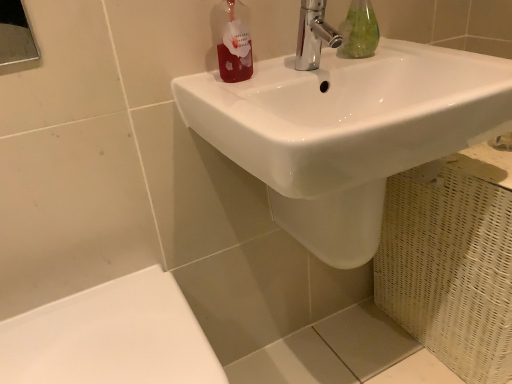
Question: Is point pos(234,16) positioned closer to the camera than point pos(184,332)?

Choices:
 (A) farther
 (B) closer

Answer: (A)

Question: From the image's perspective, relative to white glossy porcelain at lower left, is translucent red bottle at upper center above or below?

Choices:
 (A) above
 (B) below

Answer: (A)

Question: Which object is the closest to the chrome/metallic faucet at upper center?

Choices:
 (A) white glossy porcelain at lower left
 (B) translucent red bottle at upper center
 (C) green glass bottle at upper center
 (D) white glossy sink at upper center

Answer: (C)

Question: Which of these objects is positioned farthest from the white glossy porcelain at lower left?

Choices:
 (A) green glass bottle at upper center
 (B) chrome/metallic faucet at upper center
 (C) translucent red bottle at upper center
 (D) white glossy sink at upper center

Answer: (A)